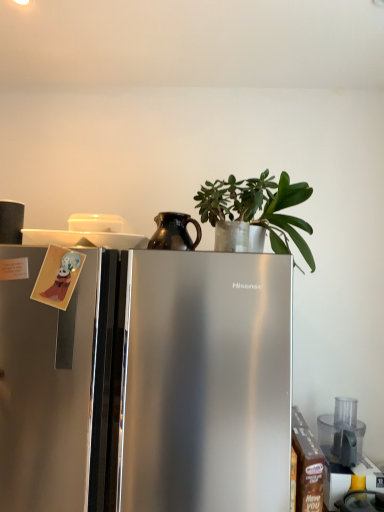
Question: Is there a large distance between satin silver refrigerator at center and shiny brown pitcher at center, the first appliance in the front-to-back sequence?

Choices:
 (A) yes
 (B) no

Answer: (B)

Question: Could you tell me if satin silver refrigerator at center is turned towards shiny brown pitcher at center, the first appliance in the front-to-back sequence?

Choices:
 (A) yes
 (B) no

Answer: (B)

Question: Is the position of satin silver refrigerator at center less distant than that of shiny brown pitcher at center, which ranks as the 2th appliance in left-to-right order?

Choices:
 (A) yes
 (B) no

Answer: (A)

Question: Does satin silver refrigerator at center have a greater width compared to shiny brown pitcher at center, arranged as the second appliance when ordered from the bottom?

Choices:
 (A) no
 (B) yes

Answer: (B)

Question: Would you say shiny brown pitcher at center, which ranks as the 2th appliance in left-to-right order, is part of satin silver refrigerator at center's contents?

Choices:
 (A) no
 (B) yes

Answer: (A)

Question: Is transparent plastic food processor at lower right, marked as the 1th appliance in a bottom-to-top arrangement, in front of or behind shiny brown pitcher at center, acting as the 3th appliance starting from the back, in the image?

Choices:
 (A) behind
 (B) front

Answer: (A)

Question: From a real-world perspective, is transparent plastic food processor at lower right, arranged as the first appliance when viewed from the back, above or below shiny brown pitcher at center, acting as the 3th appliance starting from the back?

Choices:
 (A) above
 (B) below

Answer: (B)

Question: From their relative heights in the image, would you say transparent plastic food processor at lower right, the third appliance when ordered from left to right, is taller or shorter than shiny brown pitcher at center, positioned as the second appliance in right-to-left order?

Choices:
 (A) short
 (B) tall

Answer: (B)

Question: Visually, is transparent plastic food processor at lower right, the third appliance viewed from the front, positioned to the left or to the right of shiny brown pitcher at center, which ranks as the 2th appliance in left-to-right order?

Choices:
 (A) left
 (B) right

Answer: (B)

Question: Is matte black coffee cup at upper left, which is the 2th appliance in back-to-front order, taller or shorter than transparent plastic food processor at lower right, the third appliance viewed from the front?

Choices:
 (A) short
 (B) tall

Answer: (A)

Question: Is matte black coffee cup at upper left, the 3th appliance from the bottom, inside the boundaries of transparent plastic food processor at lower right, arranged as the first appliance when viewed from the back, or outside?

Choices:
 (A) outside
 (B) inside

Answer: (A)

Question: Is matte black coffee cup at upper left, which appears as the third appliance when viewed from the right, wider or thinner than transparent plastic food processor at lower right, marked as the 1th appliance in a bottom-to-top arrangement?

Choices:
 (A) thin
 (B) wide

Answer: (A)

Question: Is point (16, 211) closer or farther from the camera than point (334, 400)?

Choices:
 (A) closer
 (B) farther

Answer: (A)

Question: Would you say matte black coffee cup at upper left, which is the 2th appliance in back-to-front order, is inside or outside green matte plant at upper center?

Choices:
 (A) outside
 (B) inside

Answer: (A)

Question: Relative to green matte plant at upper center, is matte black coffee cup at upper left, the 1th appliance viewed from the top, in front or behind?

Choices:
 (A) front
 (B) behind

Answer: (B)